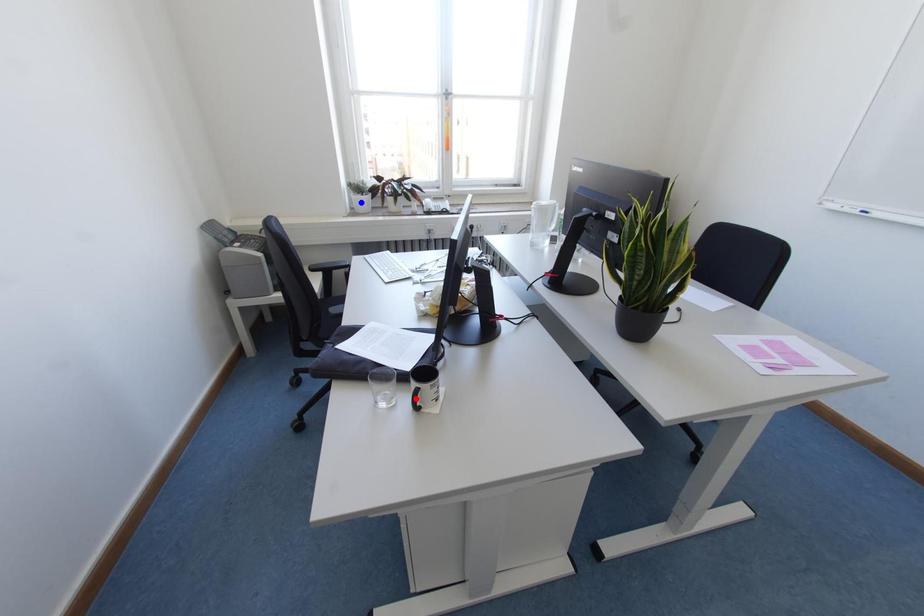
Question: Two points are marked on the image. Which point is closer to the camera?

Choices:
 (A) Blue point is closer.
 (B) Red point is closer.

Answer: (B)